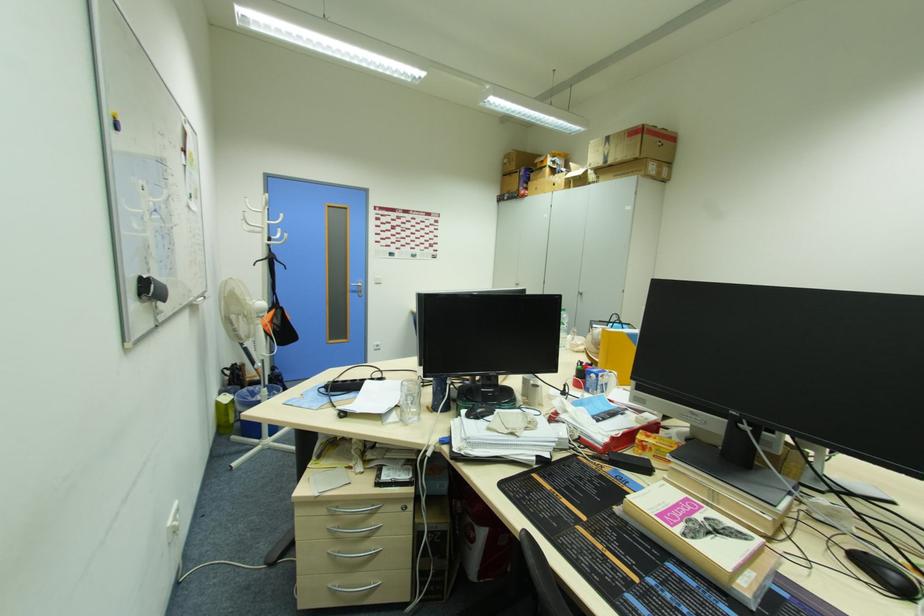
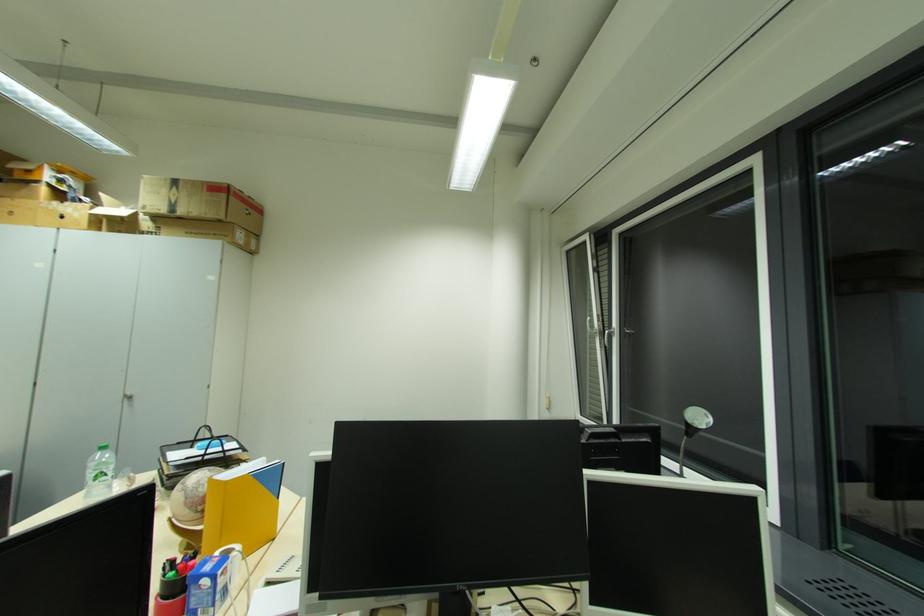
In the second image, find the point that corresponds to the point at 585,363 in the first image.

(176, 564)